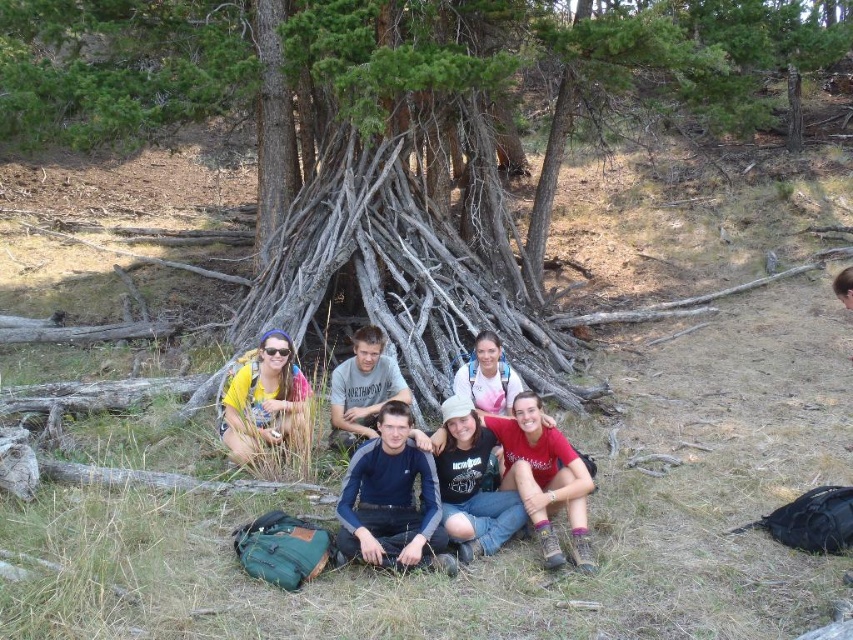
You are planning to hang a small backpack between the dark blue fleece at center and the pink fabric shirt at center. Which object should you place the backpack closer to if you want it to be positioned to the right side of the two?

The backpack should be placed closer to the dark blue fleece at center because it is wider than the pink fabric shirt at center, so its right side extends further to the right.

You are an outdoor enthusiast planning to take a photo of the yellow fabric at lower left and the dark blue sweater at center. Which object should you focus on first if you want to capture both in one shot without moving the camera?

You should focus on the dark blue sweater at center first because the yellow fabric at lower left is taller than the dark blue sweater at center, so adjusting focus to the taller object first might ensure both are in frame.